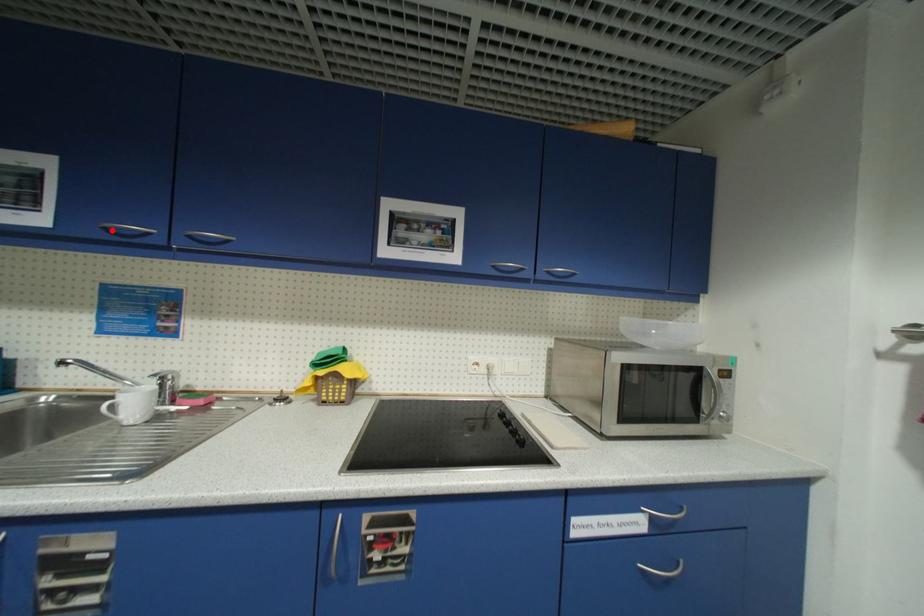
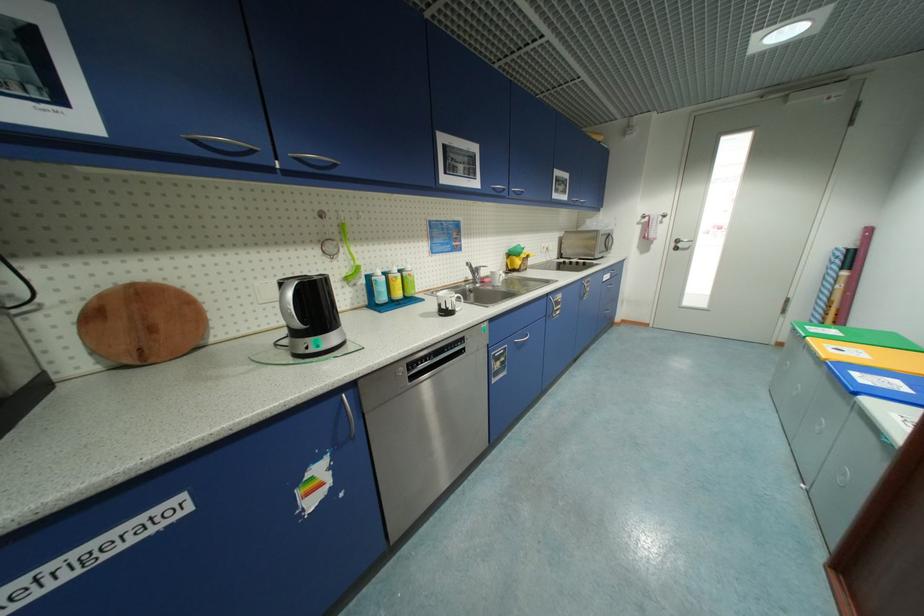
Find the pixel in the second image that matches the highlighted location in the first image.

(499, 190)